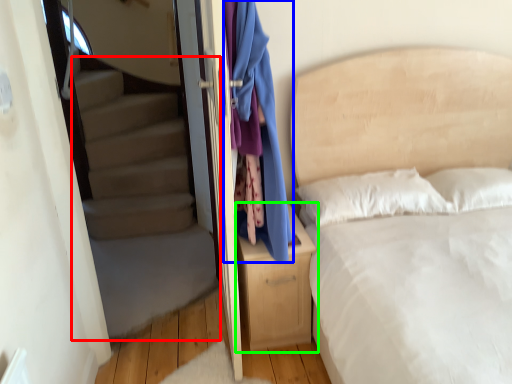
Question: Considering the real-world distances, which object is closest to stairwell (highlighted by a red box)? clothing (highlighted by a blue box) or nightstand (highlighted by a green box).

Choices:
 (A) clothing
 (B) nightstand

Answer: (B)